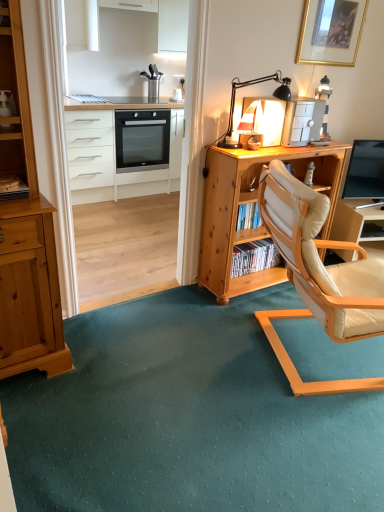
Question: Choose the correct answer: Is matte black tv at right inside white plastic printer at upper right, the first appliance viewed from the right, or outside it?

Choices:
 (A) outside
 (B) inside

Answer: (A)

Question: Considering the positions of matte black tv at right and white plastic printer at upper right, the first appliance viewed from the right, in the image, is matte black tv at right wider or thinner than white plastic printer at upper right, the first appliance viewed from the right,?

Choices:
 (A) wide
 (B) thin

Answer: (B)

Question: Which is farther from the white leather chair at lower right?

Choices:
 (A) black metal table lamp at upper right
 (B) black glass oven at center
 (C) matte white lamp at upper center, placed as the 2th appliance when sorted from right to left
 (D) beige leather chair at center-right
 (E) white fabric curtain at upper left

Answer: (B)

Question: Which of these objects is positioned closest to the white fabric curtain at upper left?

Choices:
 (A) white glossy chest of drawers at upper left
 (B) gold-framed picture at upper right
 (C) beige leather chair at center-right
 (D) matte white lamp at upper center, which is the 1th appliance in left-to-right order
 (E) matte black tv at right

Answer: (D)